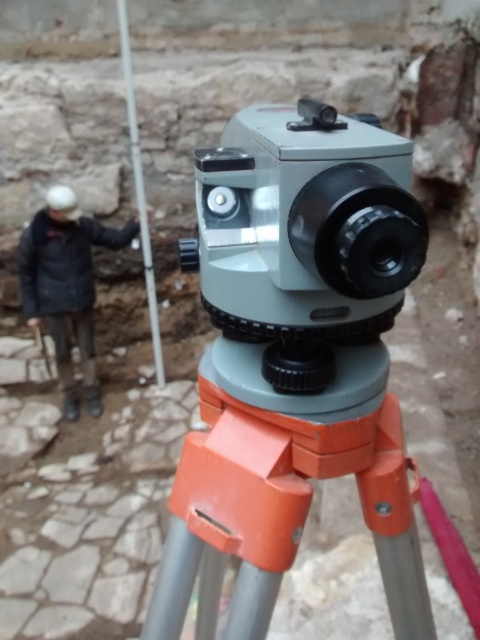
Question: Which point is farther to the camera?

Choices:
 (A) metallic pole at upper left
 (B) dark gray jacket at left
 (C) orange plastic tripod at center

Answer: (B)

Question: Is orange plastic tripod at center above metallic pole at upper left?

Choices:
 (A) yes
 (B) no

Answer: (B)

Question: Does dark gray jacket at left appear under metallic pole at upper left?

Choices:
 (A) no
 (B) yes

Answer: (B)

Question: Does matte gray video camera at center appear on the right side of orange plastic tripod at center?

Choices:
 (A) yes
 (B) no

Answer: (B)

Question: Estimate the real-world distances between objects in this image. Which object is closer to the dark gray jacket at left?

Choices:
 (A) orange plastic tripod at center
 (B) metallic pole at upper left

Answer: (B)

Question: Which object appears closest to the camera in this image?

Choices:
 (A) matte gray video camera at center
 (B) dark gray jacket at left

Answer: (A)